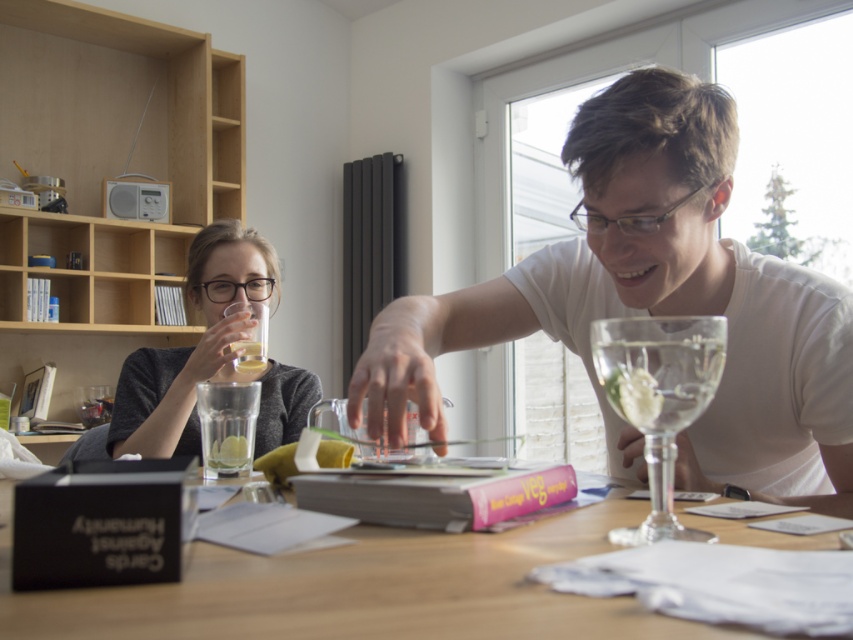
Locate an element on the screen. clear glass at center is located at coordinates (227, 426).

Between point (257, 397) and point (222, 461), which one is positioned behind?

Positioned behind is point (257, 397).

At what (x,y) coordinates should I click in order to perform the action: click on clear glass at center. Please return your answer as a coordinate pair (x, y). Image resolution: width=853 pixels, height=640 pixels. Looking at the image, I should click on (227, 426).

Is white matte glass at center taller than yellow translucent lemon at upper center?

Correct, white matte glass at center is much taller as yellow translucent lemon at upper center.

Is white matte glass at center thinner than yellow translucent lemon at upper center?

No, white matte glass at center is not thinner than yellow translucent lemon at upper center.

Which is behind, point (662, 300) or point (219, 442)?

Positioned behind is point (219, 442).

Identify the location of white matte glass at center. (654, 301).

Is green translucent lime at center thinner than translucent glass at upper center?

Yes, green translucent lime at center is thinner than translucent glass at upper center.

Does green translucent lime at center appear on the left side of translucent glass at upper center?

In fact, green translucent lime at center is to the right of translucent glass at upper center.

Does point (610, 400) lie behind point (260, 364)?

No, it is in front of (260, 364).

This screenshot has height=640, width=853. What are the coordinates of `green translucent lime at center` in the screenshot? It's located at (634, 396).